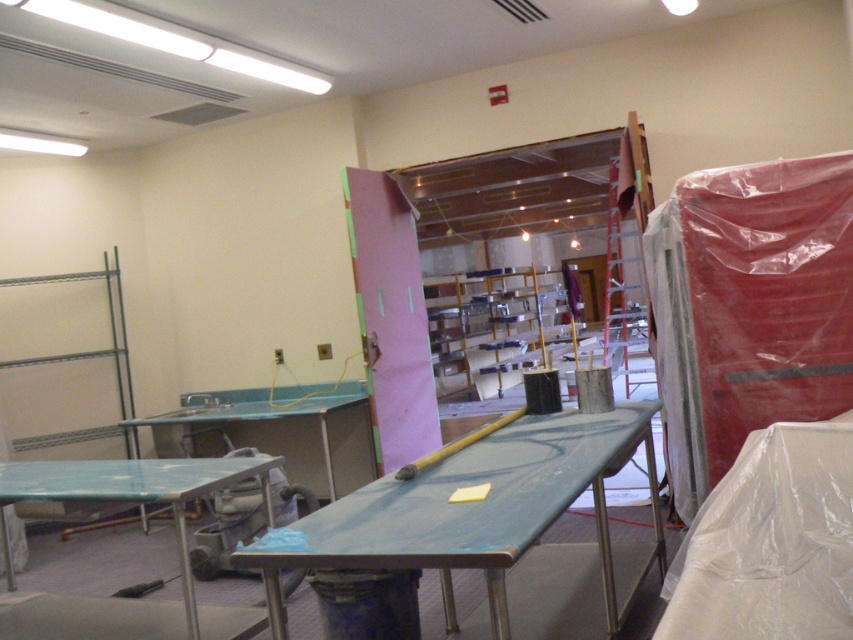
Is blue laminate table at lower left above metallic blue table at center?

Actually, blue laminate table at lower left is below metallic blue table at center.

Can you confirm if blue laminate table at lower left is positioned to the right of metallic blue table at center?

In fact, blue laminate table at lower left is to the left of metallic blue table at center.

Locate an element on the screen. This screenshot has width=853, height=640. blue laminate table at lower left is located at coordinates (138, 502).

Which of these two, green matte table at center or metallic blue table at center, stands shorter?

With less height is green matte table at center.

Is green matte table at center closer to camera compared to metallic blue table at center?

Yes, it is.

Between point (619, 444) and point (167, 445), which one is positioned behind?

Point (167, 445)

The height and width of the screenshot is (640, 853). What are the coordinates of `green matte table at center` in the screenshot? It's located at (497, 528).

Is green matte table at center closer to camera compared to blue laminate table at lower left?

Yes, it is.

Measure the distance between point (550,460) and camera.

Point (550,460) and camera are 2.70 meters apart from each other.

You are a GUI agent. You are given a task and a screenshot of the screen. Output one action in this format:
    pyautogui.click(x=<x>, y=<y>)
    Task: Click on the green matte table at center
    
    Given the screenshot: What is the action you would take?
    pyautogui.click(x=497, y=528)